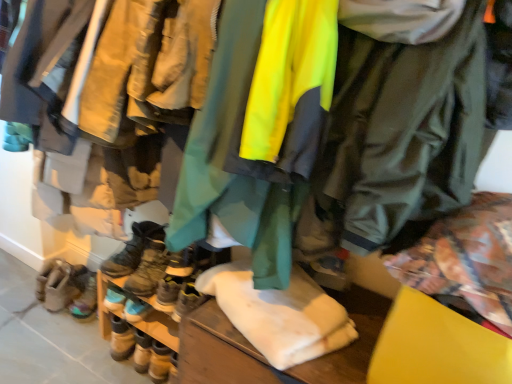
You are a GUI agent. You are given a task and a screenshot of the screen. Output one action in this format:
    pyautogui.click(x=<x>, y=<y>)
    Task: Click on the vacant space in front of multicolored suede boots at lower left, which is counted as the second footwear, starting from the left
    
    Given the screenshot: What is the action you would take?
    pyautogui.click(x=67, y=338)